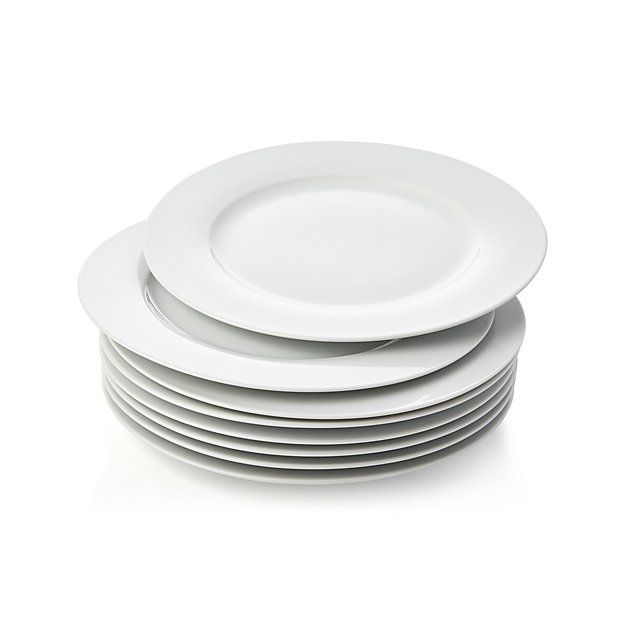
At what (x,y) coordinates should I click in order to perform the action: click on white plate. Please return your answer as a coordinate pair (x, y). Looking at the image, I should click on 288,481, 292,468, 292,454, 299,442, 242,418, 250,411, 258,389, 292,332.